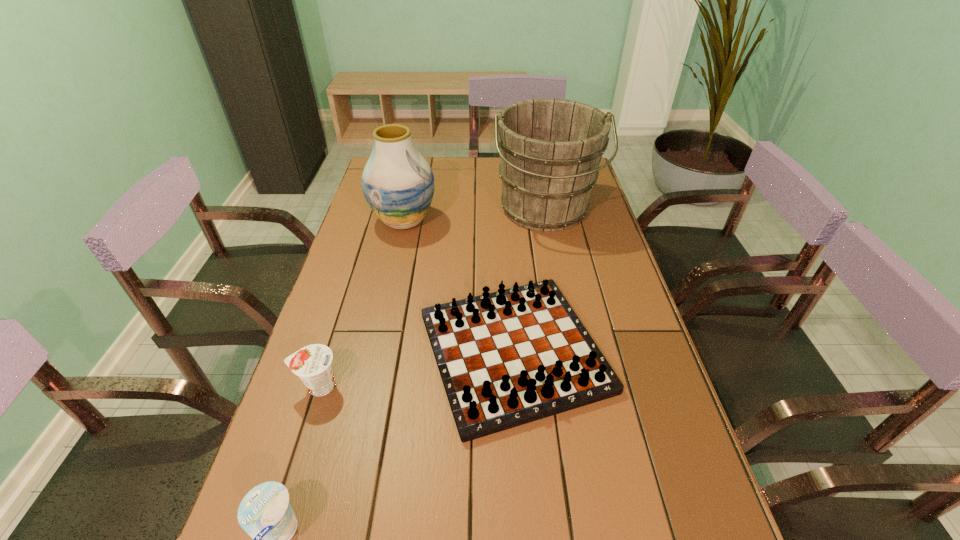
Where is `vacant space that is in between the chessboard and the bucket`? This screenshot has width=960, height=540. vacant space that is in between the chessboard and the bucket is located at coordinates (529, 281).

Where is `free space between the bucket and the farther yogurt`? This screenshot has height=540, width=960. free space between the bucket and the farther yogurt is located at coordinates (431, 298).

What are the coordinates of `vacant area between the vase and the bucket` in the screenshot? It's located at (474, 215).

Locate an element on the screen. This screenshot has height=540, width=960. object that stands as the fourth closest to the bucket is located at coordinates (265, 512).

Select which object is the fourth closest to the nearer yogurt. Please provide its 2D coordinates. Your answer should be formatted as a tuple, i.e. [(x, y)], where the tuple contains the x and y coordinates of a point satisfying the conditions above.

[(550, 150)]